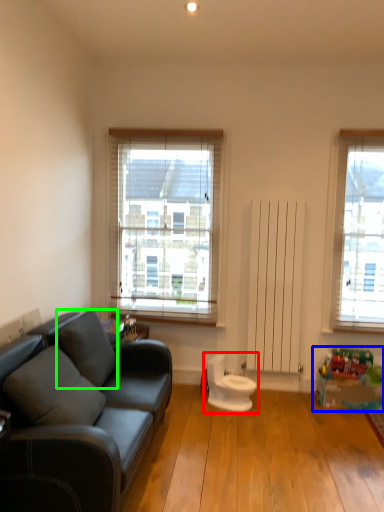
Question: Which object is the farthest from swivel chair (highlighted by a red box)? Choose among these: toy (highlighted by a blue box) or pillow (highlighted by a green box).

Choices:
 (A) toy
 (B) pillow

Answer: (B)